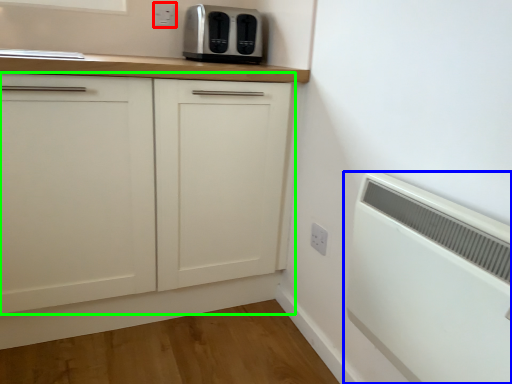
Question: Which object is the closest to the electric outlet (highlighted by a red box)? Choose among these: home appliance (highlighted by a blue box) or cabinetry (highlighted by a green box).

Choices:
 (A) home appliance
 (B) cabinetry

Answer: (B)